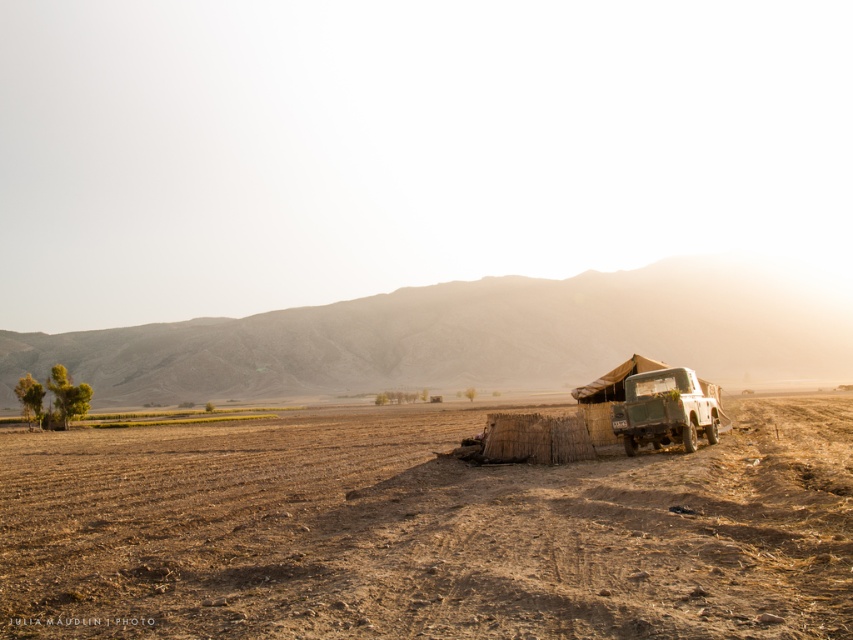
Does brown dirt field at center have a lesser height compared to matte green jeep at right?

No.

How much distance is there between brown dirt field at center and matte green jeep at right?

They are 11.82 meters apart.

Who is more distant from viewer, (253,492) or (631,412)?

Positioned behind is point (631,412).

Where is `brown dirt field at center`? The image size is (853, 640). brown dirt field at center is located at coordinates (425, 531).